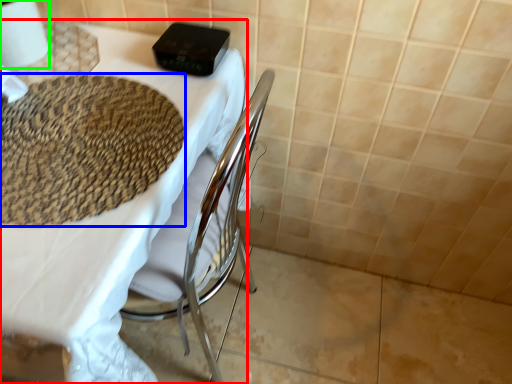
Question: Which object is positioned farthest from table (highlighted by a red box)? Select from mat (highlighted by a blue box) and toilet paper (highlighted by a green box).

Choices:
 (A) mat
 (B) toilet paper

Answer: (B)